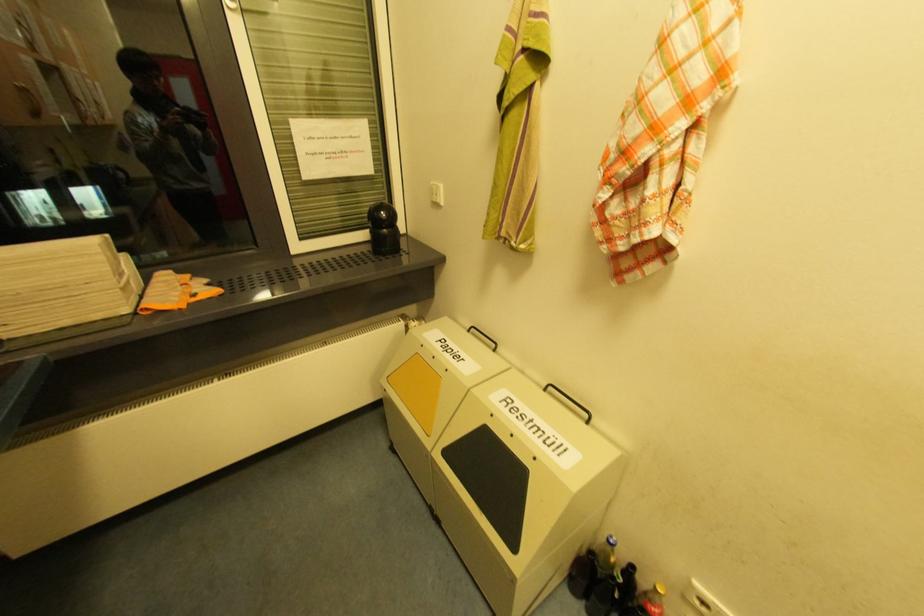
The image size is (924, 616). What do you see at coordinates (489, 472) in the screenshot?
I see `a black bin flap` at bounding box center [489, 472].